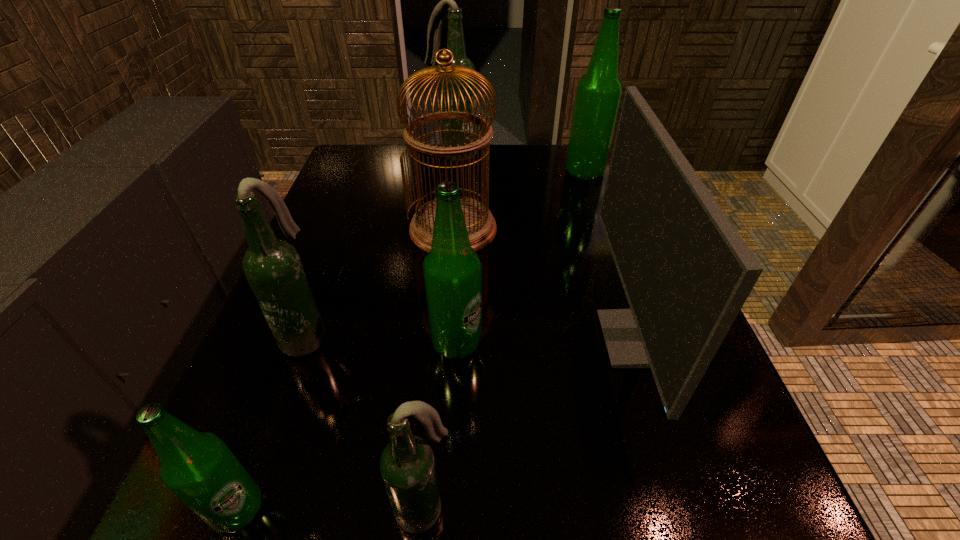
This screenshot has height=540, width=960. What are the coordinates of `vacant space located on the label of the second green beer bottle from right to left` in the screenshot? It's located at (697, 343).

Locate an element on the screen. blank area located on the front of the second farthest dark beer bottle is located at coordinates 233,529.

I want to click on free region located 0.280m on the label of the leftmost green beer bottle, so click(x=490, y=509).

Locate an element on the screen. The image size is (960, 540). vacant position located 0.130m on the right of the nearest dark beer bottle is located at coordinates (558, 509).

I want to click on beer bottle that is at the right edge, so click(598, 92).

The image size is (960, 540). I want to click on computer monitor located at the right edge, so click(x=686, y=272).

Where is `object at the near left corner`? object at the near left corner is located at coordinates (197, 467).

What are the coordinates of `object situated at the far right corner` in the screenshot? It's located at (598, 92).

Locate an element on the screen. This screenshot has width=960, height=540. vacant space at the far edge is located at coordinates (535, 177).

The width and height of the screenshot is (960, 540). I want to click on free region at the near edge of the desktop, so click(558, 494).